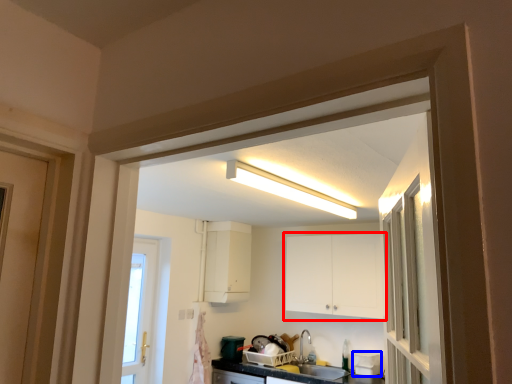
Question: Which of the following is the closest to the observer, cabinetry (highlighted by a red box) or appliance (highlighted by a blue box)?

Choices:
 (A) cabinetry
 (B) appliance

Answer: (A)